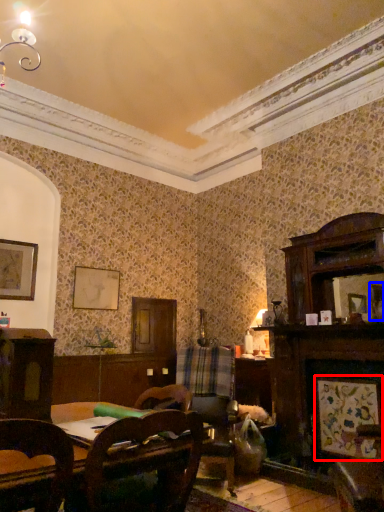
Question: Which of the following is the closest to the observer, picture frame (highlighted by a red box) or picture frame (highlighted by a blue box)?

Choices:
 (A) picture frame
 (B) picture frame

Answer: (A)